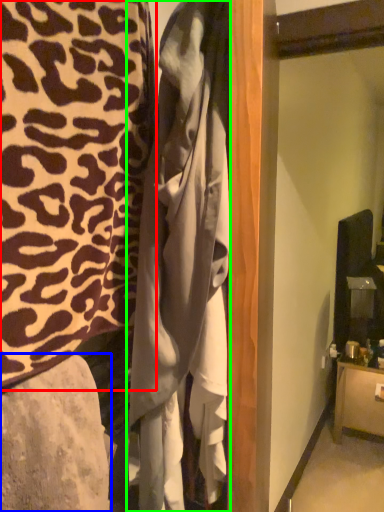
Question: Based on their relative distances, which object is nearer to furniture (highlighted by a red box)? Choose from furniture (highlighted by a blue box) and clothing (highlighted by a green box).

Choices:
 (A) furniture
 (B) clothing

Answer: (B)